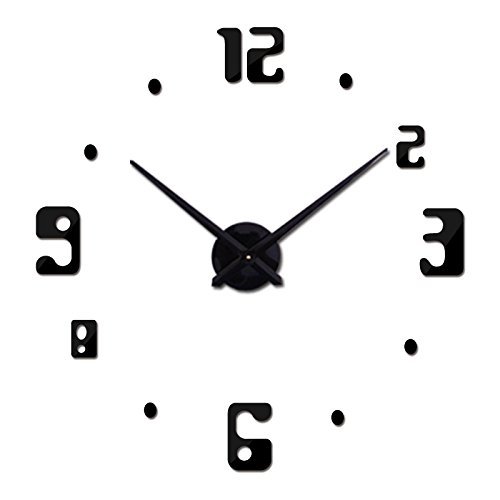
This screenshot has height=500, width=500. In order to click on clocknumbers in this screenshot , I will do `click(327, 317)`, `click(263, 50)`, `click(408, 152)`, `click(433, 241)`, `click(250, 435)`, `click(87, 339)`, `click(73, 247)`.